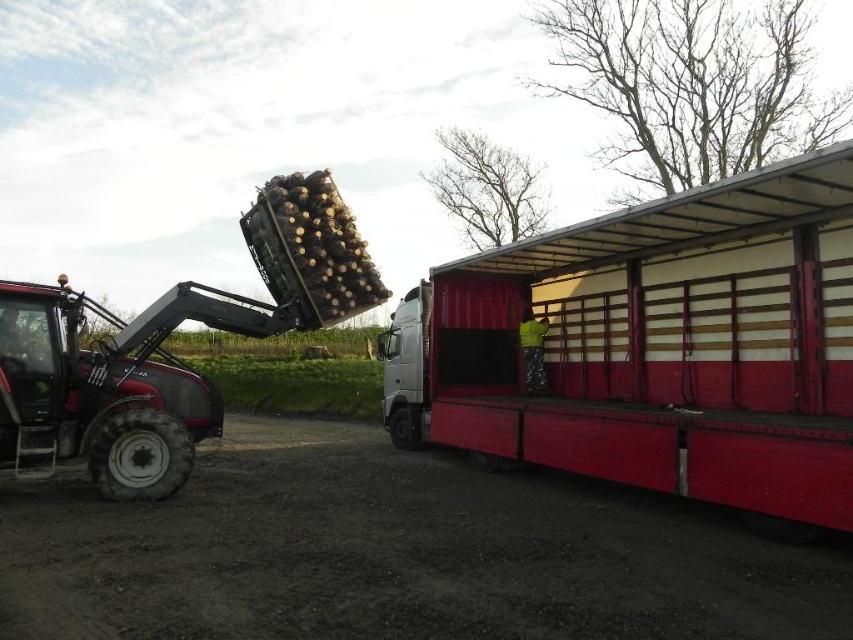
Is point (660, 266) farther from camera compared to point (16, 292)?

Yes, it is behind point (16, 292).

Is point (801, 392) less distant than point (73, 424)?

That is False.

This screenshot has height=640, width=853. Find the location of `metallic red truck at center`. metallic red truck at center is located at coordinates (656, 346).